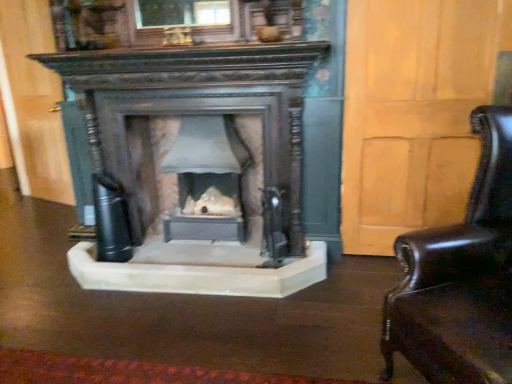
Question: From the image's perspective, is matte gray stone fireplace at center located above or below shiny black leather swivel chair at right?

Choices:
 (A) above
 (B) below

Answer: (A)

Question: In terms of height, does matte gray stone fireplace at center look taller or shorter compared to shiny black leather swivel chair at right?

Choices:
 (A) short
 (B) tall

Answer: (A)

Question: Based on their positions, is matte gray stone fireplace at center located to the left or right of shiny black leather swivel chair at right?

Choices:
 (A) right
 (B) left

Answer: (B)

Question: Is point (505, 132) positioned closer to the camera than point (239, 210)?

Choices:
 (A) farther
 (B) closer

Answer: (B)

Question: Considering the positions of shiny black leather swivel chair at right and matte gray stone fireplace at center in the image, is shiny black leather swivel chair at right taller or shorter than matte gray stone fireplace at center?

Choices:
 (A) tall
 (B) short

Answer: (A)

Question: Choose the correct answer: Is shiny black leather swivel chair at right inside matte gray stone fireplace at center or outside it?

Choices:
 (A) inside
 (B) outside

Answer: (B)

Question: From the image's perspective, is shiny black leather swivel chair at right positioned above or below matte gray stone fireplace at center?

Choices:
 (A) below
 (B) above

Answer: (A)